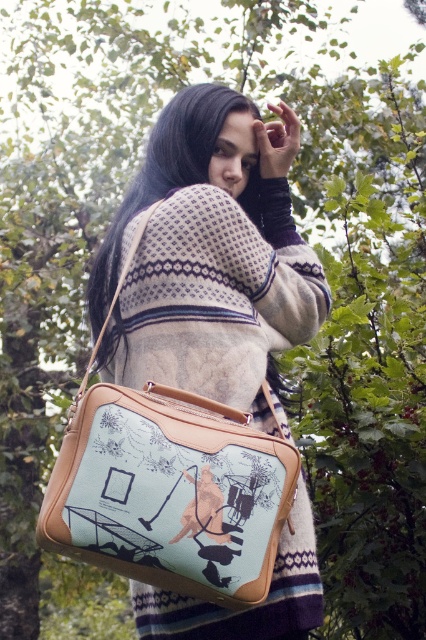
Can you confirm if matte beige bag at lower left is positioned to the left of light blue fabric bag at center?

No, matte beige bag at lower left is not to the left of light blue fabric bag at center.

Is matte beige bag at lower left wider than light blue fabric bag at center?

Yes, matte beige bag at lower left is wider than light blue fabric bag at center.

The height and width of the screenshot is (640, 426). In order to click on matte beige bag at lower left in this screenshot , I will do `click(210, 257)`.

Identify the location of matte beige bag at lower left. (210, 257).